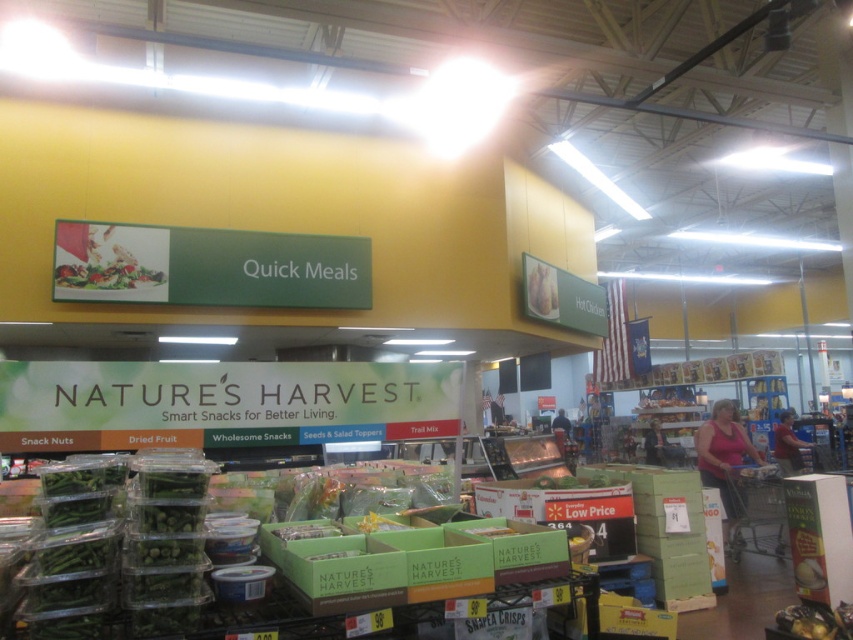
Who is higher up, pink fabric shirt at lower right or matte plastic salad at upper center?

matte plastic salad at upper center is higher up.

Is pink fabric shirt at lower right taller than matte plastic salad at upper center?

Indeed, pink fabric shirt at lower right has a greater height compared to matte plastic salad at upper center.

Is point (706, 472) positioned before point (67, 280)?

No, (706, 472) is further to viewer.

I want to click on pink fabric shirt at lower right, so tap(723, 454).